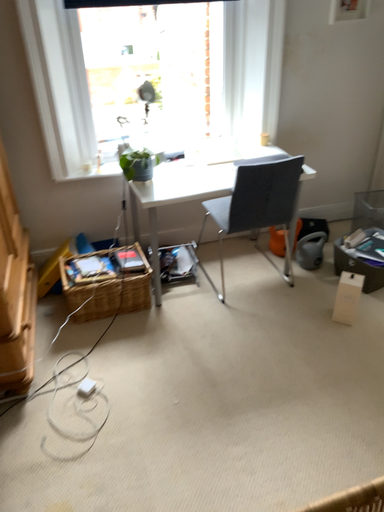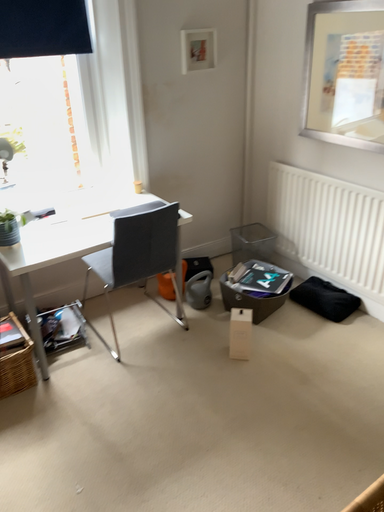
Question: How did the camera likely rotate when shooting the video?

Choices:
 (A) rotated downward
 (B) rotated upward

Answer: (B)